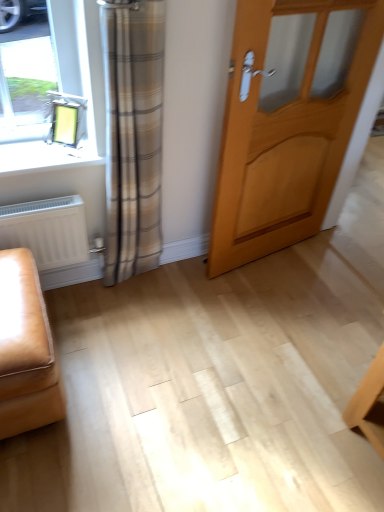
Question: From the image's perspective, is light wood door at center under white matte radiator at lower left?

Choices:
 (A) no
 (B) yes

Answer: (A)

Question: Are light wood door at center and white matte radiator at lower left located far from each other?

Choices:
 (A) yes
 (B) no

Answer: (B)

Question: Is light wood door at center closer to the viewer compared to white matte radiator at lower left?

Choices:
 (A) no
 (B) yes

Answer: (B)

Question: Can we say light wood door at center lies outside white matte radiator at lower left?

Choices:
 (A) yes
 (B) no

Answer: (A)

Question: Does light wood door at center have a greater height compared to white matte radiator at lower left?

Choices:
 (A) yes
 (B) no

Answer: (A)

Question: Would you say leather ottoman at lower left is inside or outside white matte radiator at lower left?

Choices:
 (A) inside
 (B) outside

Answer: (B)

Question: Based on their sizes in the image, would you say leather ottoman at lower left is bigger or smaller than white matte radiator at lower left?

Choices:
 (A) small
 (B) big

Answer: (B)

Question: Is point (34, 282) positioned closer to the camera than point (46, 232)?

Choices:
 (A) closer
 (B) farther

Answer: (A)

Question: In the image, is leather ottoman at lower left positioned in front of or behind white matte radiator at lower left?

Choices:
 (A) front
 (B) behind

Answer: (A)

Question: Considering the relative positions of light wood door at center and leather ottoman at lower left in the image provided, is light wood door at center to the left or to the right of leather ottoman at lower left?

Choices:
 (A) left
 (B) right

Answer: (B)

Question: Is light wood door at center bigger or smaller than leather ottoman at lower left?

Choices:
 (A) small
 (B) big

Answer: (B)

Question: Is light wood door at center taller or shorter than leather ottoman at lower left?

Choices:
 (A) tall
 (B) short

Answer: (A)

Question: Considering the positions of point (220, 159) and point (21, 316), is point (220, 159) closer or farther from the camera than point (21, 316)?

Choices:
 (A) closer
 (B) farther

Answer: (B)

Question: From the image's perspective, relative to light wood door at center, is leather ottoman at lower left above or below?

Choices:
 (A) above
 (B) below

Answer: (B)

Question: Which is correct: leather ottoman at lower left is inside light wood door at center, or outside of it?

Choices:
 (A) inside
 (B) outside

Answer: (B)